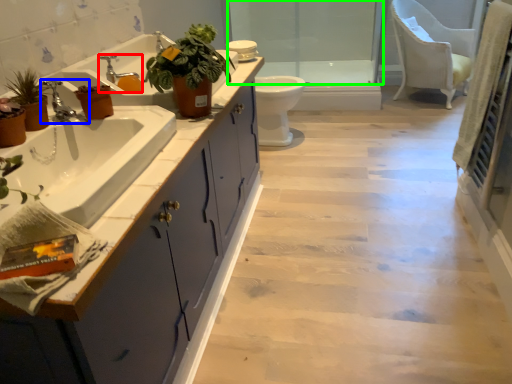
Question: Considering the real-world distances, which object is farthest from tap (highlighted by a red box)? tap (highlighted by a blue box) or glass door (highlighted by a green box)?

Choices:
 (A) tap
 (B) glass door

Answer: (B)